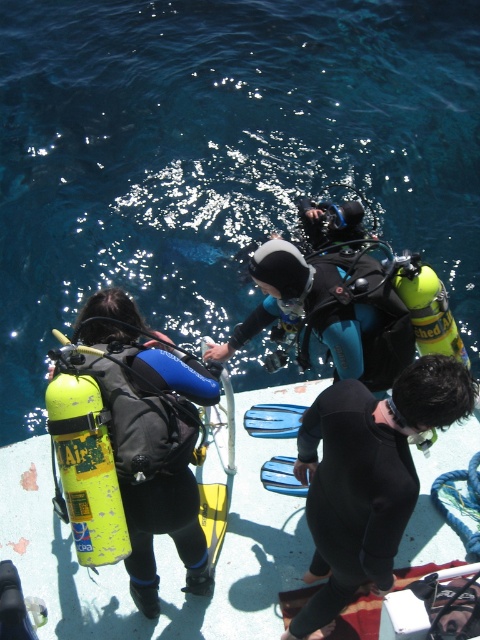
You are a scuba instructor on the boat deck. You need to hand a safety manual to the diver wearing the matte black wetsuit at center. You are currently standing next to the matte yellow scuba tank at left. Can you reach them without moving your feet?

The matte yellow scuba tank at left and matte black wetsuit at center are 37.66 inches apart. Since 37.66 inches is approximately 3.14 feet, which is a short distance, you can likely reach them without moving your feet.

You are on the boat deck and need to move from the point at coordinates point (213, 385) to the point at coordinates point (369, 301). Can you walk directly towards the second point without any obstacles?

Point (213, 385) is in front of point (369, 301), so walking directly towards the second point would require moving backward, which is not possible. Therefore, you cannot walk directly towards the second point without obstacles.